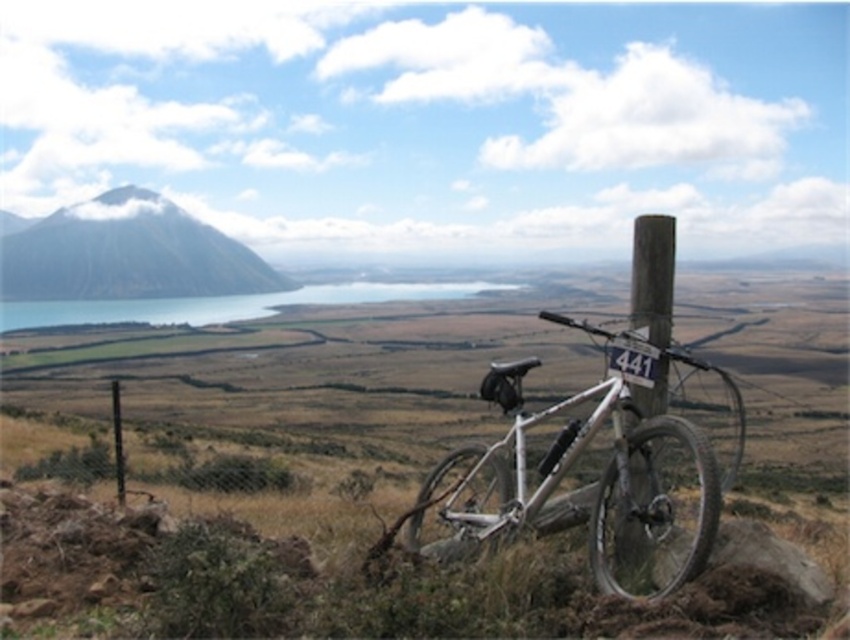
From the picture: Is blue glassy lake at center to the right of wooden post at right from the viewer's perspective?

In fact, blue glassy lake at center is to the left of wooden post at right.

Does blue glassy lake at center appear over wooden post at right?

Yes, blue glassy lake at center is above wooden post at right.

At what (x,y) coordinates should I click in order to perform the action: click on blue glassy lake at center. Please return your answer as a coordinate pair (x, y). Image resolution: width=850 pixels, height=640 pixels. Looking at the image, I should click on (225, 304).

Identify the location of blue glassy lake at center. The image size is (850, 640). (225, 304).

Does green grassy hillside at left appear on the left side of blue glassy lake at center?

Correct, you'll find green grassy hillside at left to the left of blue glassy lake at center.

Based on the photo, does green grassy hillside at left have a smaller size compared to blue glassy lake at center?

No.

Identify the location of green grassy hillside at left. The height and width of the screenshot is (640, 850). (128, 253).

The height and width of the screenshot is (640, 850). Identify the location of green grassy hillside at left. (128, 253).

Is green grassy hillside at left closer to camera compared to wooden post at right?

No.

Between green grassy hillside at left and wooden post at right, which one has more height?

With more height is green grassy hillside at left.

Measure the distance between green grassy hillside at left and camera.

green grassy hillside at left is 320.74 meters away from camera.

Identify the location of green grassy hillside at left. (128, 253).